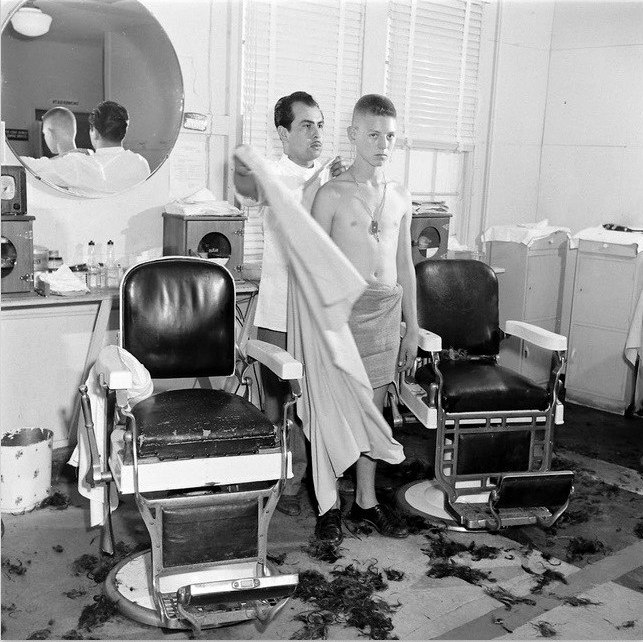
Image resolution: width=643 pixels, height=642 pixels. Find the location of `window coverings`. window coverings is located at coordinates (309, 61), (435, 76).